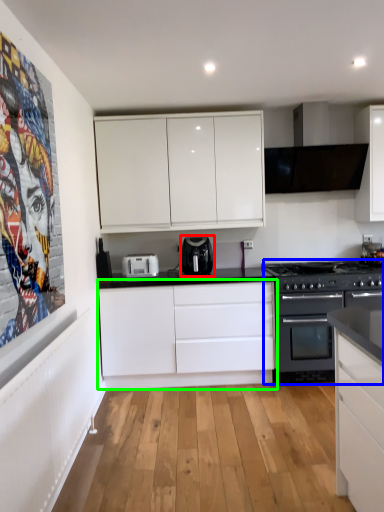
Question: Which is farther away from kitchen appliance (highlighted by a red box)? appliance (highlighted by a blue box) or cabinetry (highlighted by a green box)?

Choices:
 (A) appliance
 (B) cabinetry

Answer: (A)